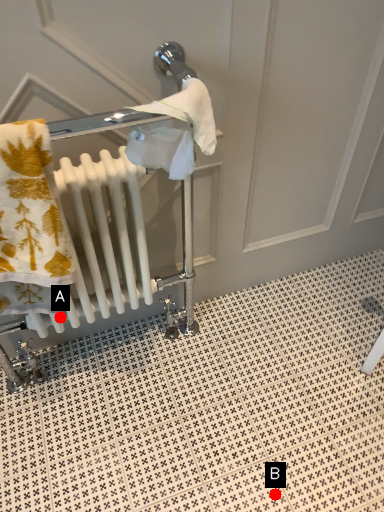
Question: Two points are circled on the image, labeled by A and B beside each circle. Which point appears farthest from the camera in this image?

Choices:
 (A) A is further
 (B) B is further

Answer: (B)